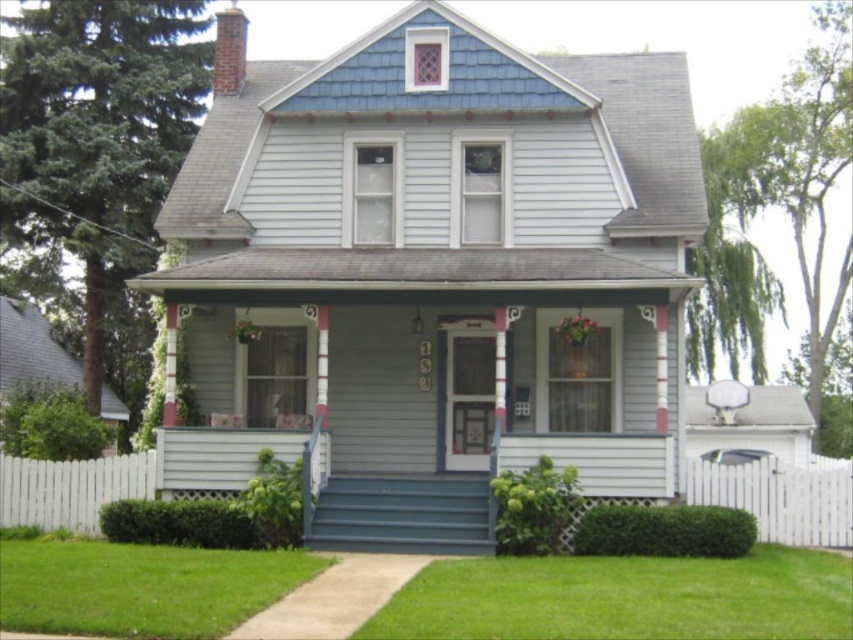
Question: From the image, what is the correct spatial relationship of green grass at lower center in relation to green grass at lower left?

Choices:
 (A) right
 (B) left

Answer: (A)

Question: Which point appears closest to the camera in this image?

Choices:
 (A) 733,573
 (B) 212,570

Answer: (B)

Question: Which of the following is the farthest from the observer?

Choices:
 (A) (442, 566)
 (B) (119, 595)

Answer: (A)

Question: Is green grass at lower center thinner than green grass at lower left?

Choices:
 (A) no
 (B) yes

Answer: (B)

Question: Does green grass at lower center have a lesser width compared to green grass at lower left?

Choices:
 (A) no
 (B) yes

Answer: (B)